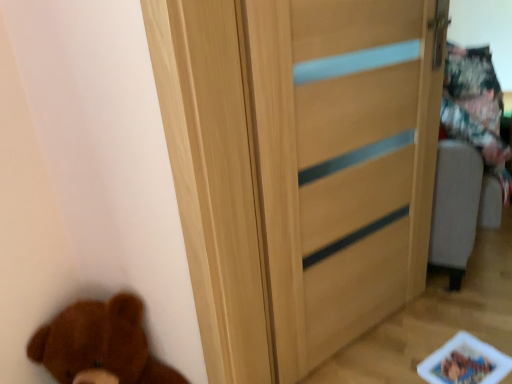
What do you see at coordinates (100, 344) in the screenshot? I see `brown plush bear at lower left` at bounding box center [100, 344].

The image size is (512, 384). What are the coordinates of `brown plush bear at lower left` in the screenshot? It's located at (100, 344).

The height and width of the screenshot is (384, 512). What are the coordinates of `light wood door at center` in the screenshot? It's located at (298, 168).

The image size is (512, 384). Describe the element at coordinates (298, 168) in the screenshot. I see `light wood door at center` at that location.

Locate an element on the screen. The image size is (512, 384). brown plush bear at lower left is located at coordinates (100, 344).

Based on the photo, does brown plush bear at lower left appear on the right side of light wood door at center?

No.

Between brown plush bear at lower left and light wood door at center, which one is positioned behind?

light wood door at center is further from the camera.

Considering the positions of points (121, 320) and (263, 145), is point (121, 320) farther from camera compared to point (263, 145)?

Yes, point (121, 320) is farther from viewer.

From the image's perspective, is brown plush bear at lower left on top of light wood door at center?

No, from the image's perspective, brown plush bear at lower left is not above light wood door at center.

Based on the photo, from a real-world perspective, is brown plush bear at lower left positioned over light wood door at center based on gravity?

No, from a real-world perspective, brown plush bear at lower left is not on top of light wood door at center.

Looking at their sizes, would you say brown plush bear at lower left is wider or thinner than light wood door at center?

Considering their sizes, brown plush bear at lower left looks broader than light wood door at center.

Considering the sizes of objects brown plush bear at lower left and light wood door at center in the image provided, who is taller, brown plush bear at lower left or light wood door at center?

With more height is light wood door at center.

Who is smaller, brown plush bear at lower left or light wood door at center?

brown plush bear at lower left.

Is brown plush bear at lower left positioned beyond the bounds of light wood door at center?

Yes, brown plush bear at lower left is outside of light wood door at center.

Is brown plush bear at lower left far from light wood door at center?

brown plush bear at lower left is near light wood door at center, not far away.

Could you tell me if brown plush bear at lower left is facing light wood door at center?

No, brown plush bear at lower left does not turn towards light wood door at center.

What's the angular difference between brown plush bear at lower left and light wood door at center's facing directions?

The angle between the facing direction of brown plush bear at lower left and the facing direction of light wood door at center is 24.9 degrees.

The image size is (512, 384). In the image, there is a light wood door at center. In order to click on brown bear below it (from a real-world perspective) in this screenshot , I will do (x=100, y=344).

Is light wood door at center to the left of brown plush bear at lower left from the viewer's perspective?

No.

In the image, is light wood door at center positioned in front of or behind brown plush bear at lower left?

In the image, light wood door at center appears behind brown plush bear at lower left.

Is point (374, 189) farther from camera compared to point (123, 358)?

Yes, it is behind point (123, 358).

From the image's perspective, which one is positioned lower, light wood door at center or brown plush bear at lower left?

brown plush bear at lower left is shown below in the image.

From a real-world perspective, is light wood door at center over brown plush bear at lower left?

Yes, from a real-world perspective, light wood door at center is on top of brown plush bear at lower left.

Considering the sizes of objects light wood door at center and brown plush bear at lower left in the image provided, who is thinner, light wood door at center or brown plush bear at lower left?

light wood door at center is thinner.

Is light wood door at center shorter than brown plush bear at lower left?

No, light wood door at center is not shorter than brown plush bear at lower left.

Who is bigger, light wood door at center or brown plush bear at lower left?

light wood door at center is bigger.

Is brown plush bear at lower left located within light wood door at center?

Definitely not — brown plush bear at lower left is not inside light wood door at center.

Is light wood door at center far from brown plush bear at lower left?

light wood door at center is actually quite close to brown plush bear at lower left.

Is light wood door at center oriented towards brown plush bear at lower left?

No.

How many degrees apart are the facing directions of light wood door at center and brown plush bear at lower left?

They differ by 24.9 degrees in their facing directions.

At what (x,y) coordinates should I click in order to perform the action: click on door to the right of brown plush bear at lower left. Please return your answer as a coordinate pair (x, y). The height and width of the screenshot is (384, 512). Looking at the image, I should click on (298, 168).

Locate an element on the screen. The height and width of the screenshot is (384, 512). door above the brown plush bear at lower left (from the image's perspective) is located at coordinates (298, 168).

The height and width of the screenshot is (384, 512). I want to click on brown bear in front of the light wood door at center, so click(100, 344).